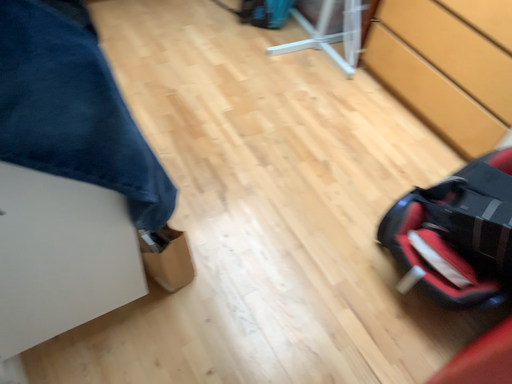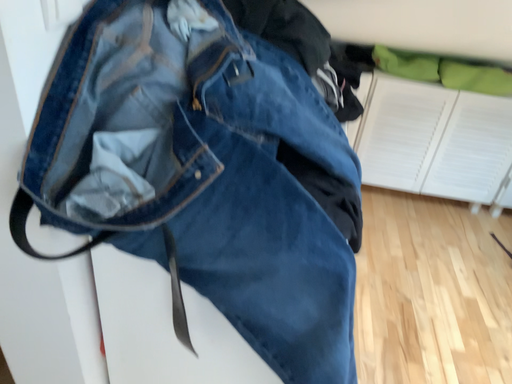
Question: How did the camera likely rotate when shooting the video?

Choices:
 (A) rotated downward
 (B) rotated upward

Answer: (B)